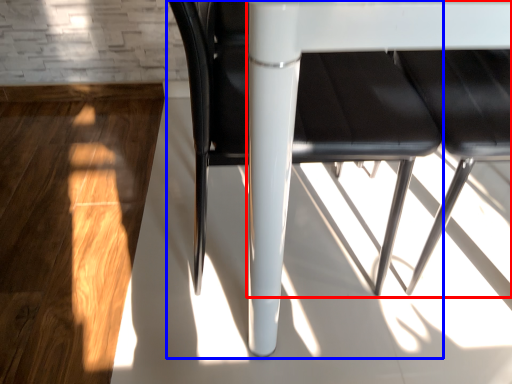
Question: Which point is closer to the camera, table (highlighted by a red box) or chair (highlighted by a blue box)?

Choices:
 (A) table
 (B) chair

Answer: (A)